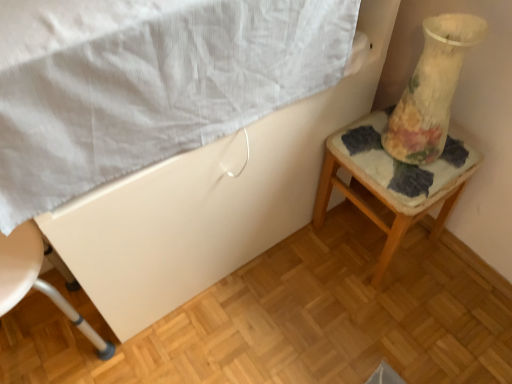
Where is `vacant area in front of floral-patterned glass at right`? This screenshot has width=512, height=384. vacant area in front of floral-patterned glass at right is located at coordinates (410, 184).